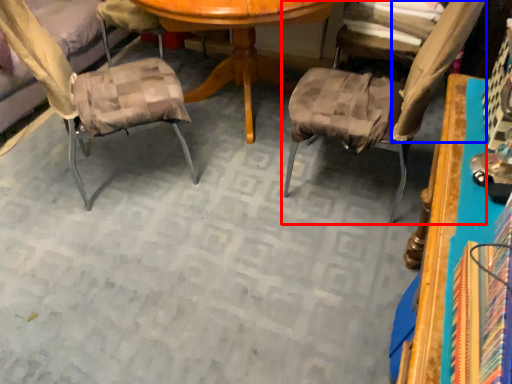
Question: Among these objects, which one is farthest to the camera, chair (highlighted by a red box) or fabric (highlighted by a blue box)?

Choices:
 (A) chair
 (B) fabric

Answer: (B)